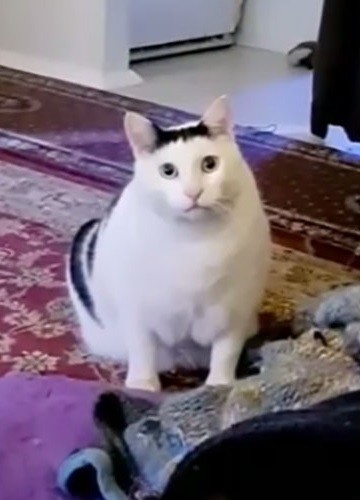
You are a GUI agent. You are given a task and a screenshot of the screen. Output one action in this format:
    pyautogui.click(x=<x>, y=<y>)
    Task: Click on the rug
    The width and height of the screenshot is (360, 500).
    Given the screenshot: What is the action you would take?
    pyautogui.click(x=37, y=253)